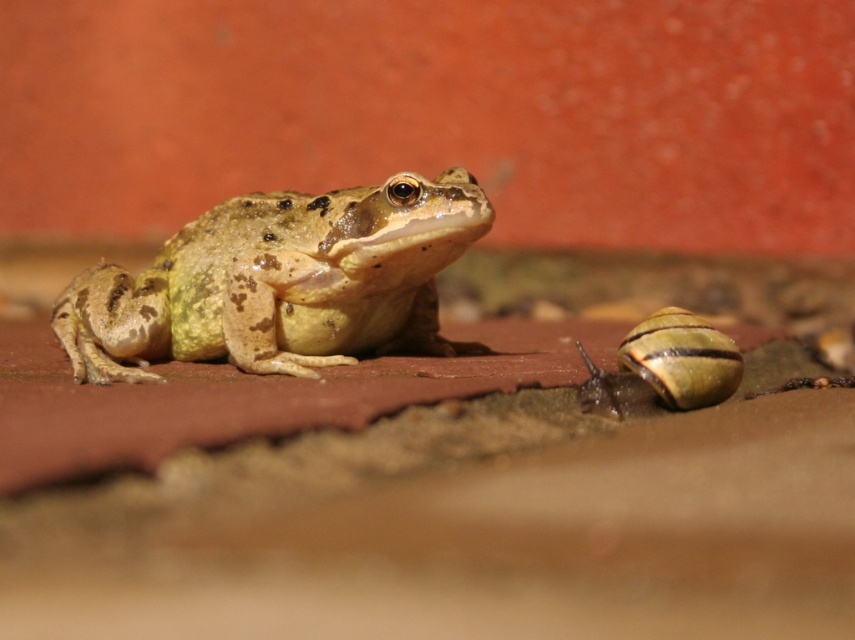
Question: Does camouflage skin frog at center lie behind shiny brown shell at lower right?

Choices:
 (A) yes
 (B) no

Answer: (A)

Question: Which point is farther to the camera?

Choices:
 (A) (674, 333)
 (B) (338, 346)

Answer: (B)

Question: Is camouflage skin frog at center in front of shiny brown shell at lower right?

Choices:
 (A) yes
 (B) no

Answer: (B)

Question: Is camouflage skin frog at center thinner than shiny brown shell at lower right?

Choices:
 (A) no
 (B) yes

Answer: (A)

Question: Which point appears farthest from the camera in this image?

Choices:
 (A) (216, 252)
 (B) (635, 355)

Answer: (A)